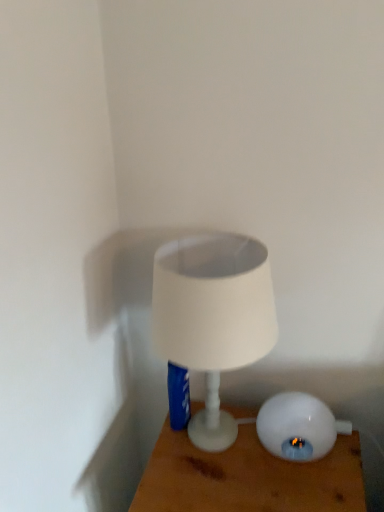
At what (x,y) coordinates should I click in order to perform the action: click on empty space that is ontop of white glossy lamp at center (from a real-world perspective). Please return your answer as a coordinate pair (x, y). This screenshot has width=384, height=512. Looking at the image, I should click on (237, 467).